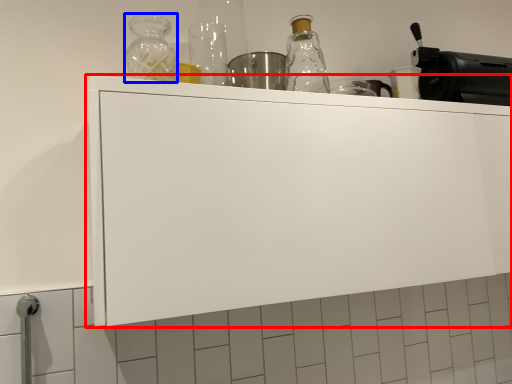
Question: Which object appears closest to the camera in this image, cabinetry (highlighted by a red box) or bottle (highlighted by a blue box)?

Choices:
 (A) cabinetry
 (B) bottle

Answer: (A)